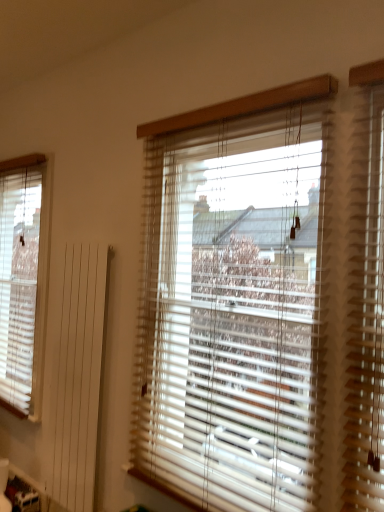
Question: In which direction should I rotate to look at wooden blinds at center, positioned as the 1th window blind in right-to-left order?

Choices:
 (A) right
 (B) left

Answer: (A)

Question: Does wooden blinds at center, which ranks as the 1th window blind in front-to-back order, have a greater width compared to white wood blinds at left, the second window blind viewed from the right?

Choices:
 (A) yes
 (B) no

Answer: (A)

Question: Does wooden blinds at center, positioned as the 1th window blind in right-to-left order, come in front of white wood blinds at left, which is counted as the 1th window blind, starting from the left?

Choices:
 (A) yes
 (B) no

Answer: (A)

Question: Is wooden blinds at center, which ranks as the second window blind in left-to-right order, positioned far away from white wood blinds at left, which is counted as the 1th window blind, starting from the left?

Choices:
 (A) yes
 (B) no

Answer: (A)

Question: Does wooden blinds at center, which is the second window blind from back to front, have a lesser width compared to white wood blinds at left, the 2th window blind when ordered from front to back?

Choices:
 (A) yes
 (B) no

Answer: (B)

Question: Considering the relative sizes of wooden blinds at center, which ranks as the 1th window blind in front-to-back order, and white wood blinds at left, the 2th window blind when ordered from front to back, in the image provided, is wooden blinds at center, which ranks as the 1th window blind in front-to-back order, taller than white wood blinds at left, the 2th window blind when ordered from front to back,?

Choices:
 (A) yes
 (B) no

Answer: (B)

Question: From the image's perspective, is wooden blinds at center, positioned as the 1th window blind in right-to-left order, beneath white wood blinds at left, which is counted as the 1th window blind, starting from the left?

Choices:
 (A) yes
 (B) no

Answer: (A)

Question: Is white wood blinds at left, the second window blind viewed from the right, taller than wooden blinds at center, which ranks as the 1th window blind in front-to-back order?

Choices:
 (A) no
 (B) yes

Answer: (B)

Question: Is white wood blinds at left, the first window blind viewed from the back, outside wooden blinds at center, which ranks as the second window blind in left-to-right order?

Choices:
 (A) no
 (B) yes

Answer: (B)

Question: Is white wood blinds at left, which is counted as the 1th window blind, starting from the left, further to camera compared to wooden blinds at center, which ranks as the second window blind in left-to-right order?

Choices:
 (A) yes
 (B) no

Answer: (A)

Question: From the image's perspective, is white wood blinds at left, the second window blind viewed from the right, on top of wooden blinds at center, which ranks as the second window blind in left-to-right order?

Choices:
 (A) no
 (B) yes

Answer: (B)

Question: Considering the relative positions of white wood blinds at left, the second window blind viewed from the right, and wooden blinds at center, which is the second window blind from back to front, in the image provided, is white wood blinds at left, the second window blind viewed from the right, to the right of wooden blinds at center, which is the second window blind from back to front, from the viewer's perspective?

Choices:
 (A) yes
 (B) no

Answer: (B)

Question: Is white wood blinds at left, the first window blind viewed from the back, aimed at wooden blinds at center, which is the second window blind from back to front?

Choices:
 (A) yes
 (B) no

Answer: (B)

Question: Considering the positions of wooden blinds at center, which ranks as the 1th window blind in front-to-back order, and white wood blinds at left, the second window blind viewed from the right, in the image, is wooden blinds at center, which ranks as the 1th window blind in front-to-back order, taller or shorter than white wood blinds at left, the second window blind viewed from the right,?

Choices:
 (A) tall
 (B) short

Answer: (B)